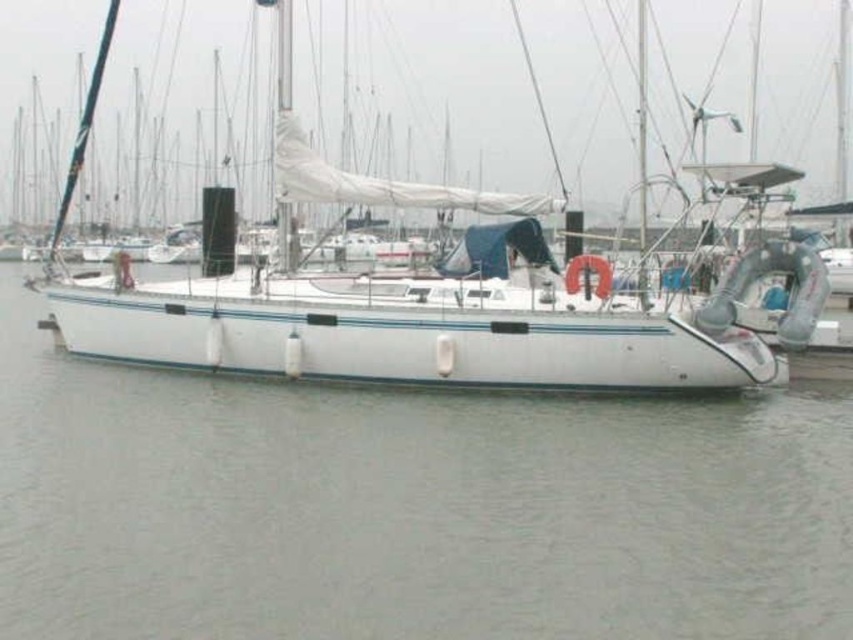
Does white matte water at center come in front of white matte sailboat at center?

Yes.

Between point (596, 563) and point (218, 301), which one is positioned in front?

Positioned in front is point (596, 563).

The image size is (853, 640). Identify the location of white matte water at center. (408, 508).